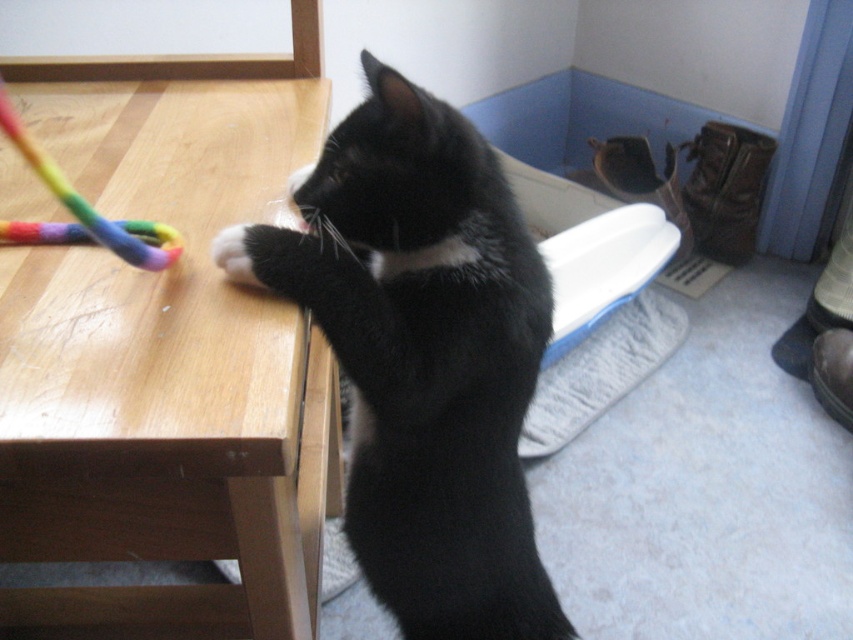
Question: Can you confirm if rainbow fabric toy at left is bigger than white fur at upper center?

Choices:
 (A) no
 (B) yes

Answer: (B)

Question: Can you confirm if wooden table at left is smaller than rainbow fabric toy at left?

Choices:
 (A) no
 (B) yes

Answer: (A)

Question: Which point is closer to the camera taking this photo?

Choices:
 (A) (297, 323)
 (B) (268, 288)
 (C) (0, 93)
 (D) (433, 536)

Answer: (A)

Question: Is rainbow fabric toy at left further to the viewer compared to white fur at upper center?

Choices:
 (A) yes
 (B) no

Answer: (B)

Question: Which of the following is the closest to the observer?

Choices:
 (A) (509, 588)
 (B) (90, 212)
 (C) (135, 636)
 (D) (219, 243)

Answer: (B)

Question: Which of the following is the farthest from the observer?

Choices:
 (A) white fur at upper center
 (B) black fur cat at center
 (C) rainbow fabric toy at left
 (D) wooden table at left

Answer: (A)